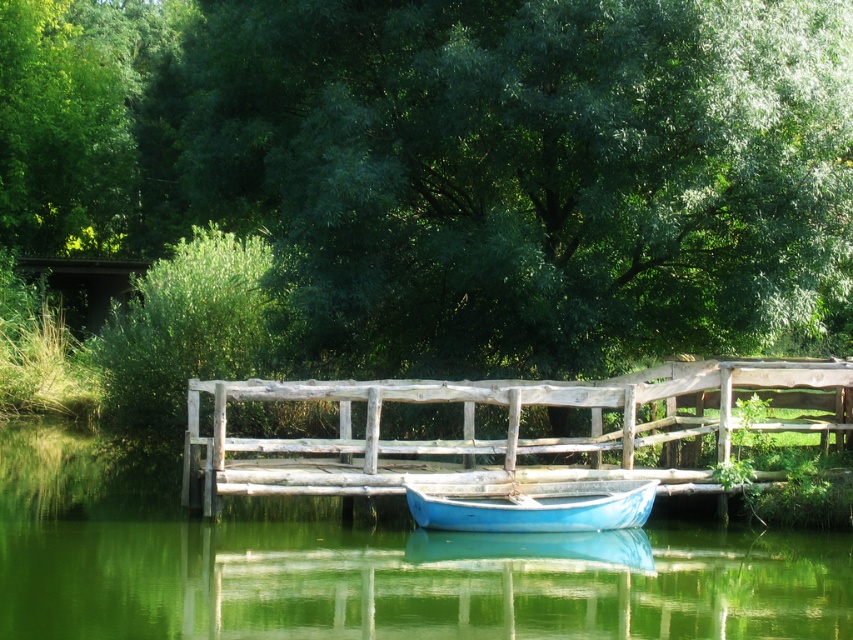
Does green leafy tree at upper center have a larger size compared to matte blue boat at center?

Correct, green leafy tree at upper center is larger in size than matte blue boat at center.

Is green leafy tree at upper center to the left of matte blue boat at center from the viewer's perspective?

Indeed, green leafy tree at upper center is positioned on the left side of matte blue boat at center.

Image resolution: width=853 pixels, height=640 pixels. In order to click on green leafy tree at upper center in this screenshot , I will do `click(453, 168)`.

Does green leafy tree at upper center lie behind weathered wood bridge at center?

No, it is in front of weathered wood bridge at center.

Can you confirm if green leafy tree at upper center is positioned to the right of weathered wood bridge at center?

No, green leafy tree at upper center is not to the right of weathered wood bridge at center.

Locate an element on the screen. green leafy tree at upper center is located at coordinates (453, 168).

Measure the distance between weathered wood bridge at center and green leafy tree at upper left.

weathered wood bridge at center and green leafy tree at upper left are 68.04 feet apart from each other.

Which is more to the left, weathered wood bridge at center or green leafy tree at upper left?

Positioned to the left is green leafy tree at upper left.

Identify the location of weathered wood bridge at center. Image resolution: width=853 pixels, height=640 pixels. (512, 442).